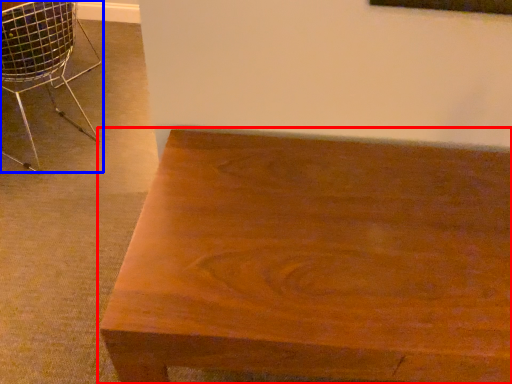
Question: Which object is further to the camera taking this photo, table (highlighted by a red box) or chair (highlighted by a blue box)?

Choices:
 (A) table
 (B) chair

Answer: (B)